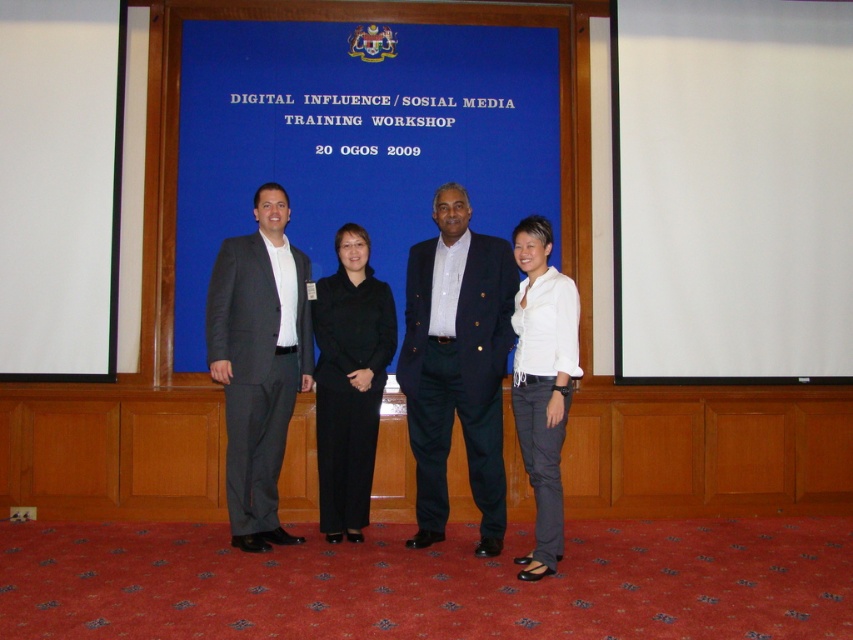
You are an event organizer who needs to set up a camera for a photo shoot. The camera is placed at the center of the room facing the backdrop. Which object, the white matte projection screen at right or the matte gray suit at left, will appear larger in the photo?

The white matte projection screen at right will appear larger in the photo because it has a larger size compared to the matte gray suit at left.

You are a photographer setting up for a group photo at the workshop. The blue matte projection screen at center is part of the setup. You need to position a camera so that it is exactly 5.44 meters away from the screen. Where should you place the camera relative to the screen?

The camera should be placed 5.44 meters away from the blue matte projection screen at center as specified in the description.